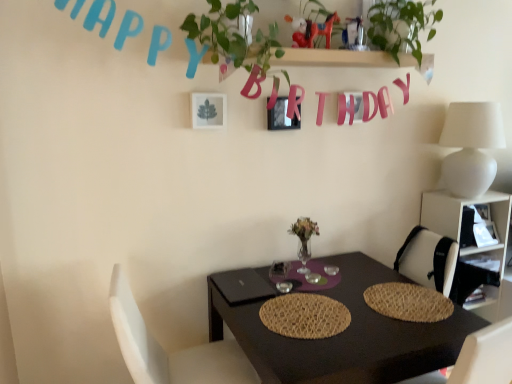
What do you see at coordinates (172, 353) in the screenshot? The image size is (512, 384). I see `white fabric chair at lower left` at bounding box center [172, 353].

This screenshot has width=512, height=384. I want to click on white fabric chair at lower left, so click(x=172, y=353).

Where is `woven straw placemat at center, which appears as the 1th mat when viewed from the left`? This screenshot has height=384, width=512. woven straw placemat at center, which appears as the 1th mat when viewed from the left is located at coordinates tap(305, 316).

I want to click on metallic silver picture frame at upper center, which is the 1th picture frame in left-to-right order, so click(x=208, y=110).

Describe the element at coordinates (354, 107) in the screenshot. I see `pink paper letter at upper center` at that location.

What do you see at coordinates (471, 147) in the screenshot? I see `white matte table lamp at upper right` at bounding box center [471, 147].

What do you see at coordinates (234, 36) in the screenshot? The image size is (512, 384). I see `green leafy plant at upper center` at bounding box center [234, 36].

Where is `woven straw placemat at center, the second mat positioned from the left`? woven straw placemat at center, the second mat positioned from the left is located at coordinates (408, 302).

Between metallic silver picture frame at upper center, which appears as the second picture frame when viewed from the right, and woven straw placemat at center, which appears as the 1th mat when viewed from the left, which one has smaller width?

metallic silver picture frame at upper center, which appears as the second picture frame when viewed from the right.

Is metallic silver picture frame at upper center, which is the 2th picture frame in back-to-front order, not near woven straw placemat at center, which appears as the 1th mat when viewed from the left?

No, metallic silver picture frame at upper center, which is the 2th picture frame in back-to-front order, is not far away from woven straw placemat at center, which appears as the 1th mat when viewed from the left.

Can you tell me how much metallic silver picture frame at upper center, which appears as the second picture frame when viewed from the right, and woven straw placemat at center, arranged as the 2th mat when viewed from the right, differ in facing direction?

The angle between the facing direction of metallic silver picture frame at upper center, which appears as the second picture frame when viewed from the right, and the facing direction of woven straw placemat at center, arranged as the 2th mat when viewed from the right, is 2.2 degrees.

From the image's perspective, is metallic silver picture frame at upper center, which is the 2th picture frame in back-to-front order, over woven straw placemat at center, which appears as the 1th mat when viewed from the left?

Indeed, from the image's perspective, metallic silver picture frame at upper center, which is the 2th picture frame in back-to-front order, is shown above woven straw placemat at center, which appears as the 1th mat when viewed from the left.

In the scene shown: Is white fabric chair at lower left bigger than pink paper letter at upper center?

Yes, white fabric chair at lower left is bigger than pink paper letter at upper center.

Which is behind, white fabric chair at lower left or pink paper letter at upper center?

pink paper letter at upper center is behind.

Would you say white fabric chair at lower left is outside pink paper letter at upper center?

Yes, white fabric chair at lower left is not within pink paper letter at upper center.

Is white fabric chair at lower left facing towards pink paper letter at upper center?

No, white fabric chair at lower left is not turned towards pink paper letter at upper center.

From a real-world perspective, does metallic silver picture frame at upper center, which is the 1th picture frame in right-to-left order, sit lower than green leafy plant at upper right?

Yes, from a real-world perspective, metallic silver picture frame at upper center, which is the 1th picture frame in right-to-left order, is under green leafy plant at upper right.

From the image's perspective, is metallic silver picture frame at upper center, which is the 1th picture frame in right-to-left order, located above or below green leafy plant at upper right?

metallic silver picture frame at upper center, which is the 1th picture frame in right-to-left order, is situated lower than green leafy plant at upper right in the image.

Do you think metallic silver picture frame at upper center, which is the 1th picture frame in right-to-left order, is within green leafy plant at upper right, or outside of it?

metallic silver picture frame at upper center, which is the 1th picture frame in right-to-left order, is spatially situated outside green leafy plant at upper right.

Considering the sizes of objects woven straw placemat at center, the 1th mat from the right, and green leafy plant at upper right in the image provided, who is smaller, woven straw placemat at center, the 1th mat from the right, or green leafy plant at upper right?

Smaller between the two is woven straw placemat at center, the 1th mat from the right.

Is woven straw placemat at center, the 1th mat from the right, aimed at green leafy plant at upper right?

No, woven straw placemat at center, the 1th mat from the right, is not oriented towards green leafy plant at upper right.

From the image's perspective, which is below, woven straw placemat at center, the 1th mat from the right, or green leafy plant at upper right?

From the image's view, woven straw placemat at center, the 1th mat from the right, is below.

Which of these two, woven straw placemat at center, the second mat positioned from the left, or green leafy plant at upper right, stands taller?

green leafy plant at upper right.

Is metallic silver picture frame at upper center, which is the 1th picture frame in right-to-left order, placed right next to black matte table at center?

No, metallic silver picture frame at upper center, which is the 1th picture frame in right-to-left order, is not next to black matte table at center.

From the image's perspective, is metallic silver picture frame at upper center, which is the 1th picture frame in back-to-front order, over black matte table at center?

Yes.

At what (x,y) coordinates should I click in order to perform the action: click on table below the metallic silver picture frame at upper center, arranged as the second picture frame when viewed from the left (from the image's perspective). Please return your answer as a coordinate pair (x, y). This screenshot has width=512, height=384. Looking at the image, I should click on (336, 335).

Between metallic silver picture frame at upper center, which is the 1th picture frame in back-to-front order, and black matte table at center, which one is positioned in front?

black matte table at center is in front.

Is there a large distance between woven straw placemat at center, the 1th mat from the right, and white matte table lamp at upper right?

That's not correct — woven straw placemat at center, the 1th mat from the right, is a little close to white matte table lamp at upper right.

Would you say white matte table lamp at upper right is part of woven straw placemat at center, the second mat positioned from the left,'s contents?

No, white matte table lamp at upper right is located outside of woven straw placemat at center, the second mat positioned from the left.

Does woven straw placemat at center, the second mat positioned from the left, have a greater height compared to white matte table lamp at upper right?

In fact, woven straw placemat at center, the second mat positioned from the left, may be shorter than white matte table lamp at upper right.

Is woven straw placemat at center, the second mat positioned from the left, at the left side of white matte table lamp at upper right?

Indeed, woven straw placemat at center, the second mat positioned from the left, is positioned on the left side of white matte table lamp at upper right.

Is metallic silver picture frame at upper center, which is counted as the first picture frame, starting from the front, not close to white fabric chair at lower left?

No.

Considering their positions, is metallic silver picture frame at upper center, which is counted as the first picture frame, starting from the front, located in front of or behind white fabric chair at lower left?

Visually, metallic silver picture frame at upper center, which is counted as the first picture frame, starting from the front, is located behind white fabric chair at lower left.

From the image's perspective, is metallic silver picture frame at upper center, which is the 1th picture frame in left-to-right order, on top of white fabric chair at lower left?

Yes, from the image's perspective, metallic silver picture frame at upper center, which is the 1th picture frame in left-to-right order, is on top of white fabric chair at lower left.

Which point is more forward, (218, 113) or (214, 382)?

Positioned in front is point (214, 382).

From the image's perspective, starting from the metallic silver picture frame at upper center, which is the 1th picture frame in left-to-right order, which mat is the 2nd one below? Please provide its 2D coordinates.

[(305, 316)]

Find the location of a particular element. The image size is (512, 384). chair on the left of pink paper letter at upper center is located at coordinates (172, 353).

Consider the image. Looking at the image, which one is located further to pink paper letter at upper center, woven straw placemat at center, the second mat positioned from the left, or metallic silver picture frame at upper center, which is counted as the first picture frame, starting from the front?

woven straw placemat at center, the second mat positioned from the left, is positioned further to the anchor pink paper letter at upper center.

Which object lies further to the anchor point white fabric chair at lower left, green leafy plant at upper center or black matte table at center?

green leafy plant at upper center.

Considering their positions, is white fabric chair at lower left positioned further to pink paper letter at upper center than metallic silver picture frame at upper center, which is counted as the second picture frame, starting from the front?

white fabric chair at lower left lies further to pink paper letter at upper center than the other object.

When comparing their distances from woven straw placemat at center, the 1th mat from the right, does black matte table at center or pink paper letter at upper center seem closer?

The object closer to woven straw placemat at center, the 1th mat from the right, is black matte table at center.

When comparing their distances from woven straw placemat at center, arranged as the 2th mat when viewed from the right, does white plastic shelf at right or white matte table lamp at upper right seem closer?

white plastic shelf at right lies closer to woven straw placemat at center, arranged as the 2th mat when viewed from the right, than the other object.

Which object lies nearer to the anchor point woven straw placemat at center, which appears as the 1th mat when viewed from the left, white plastic shelf at right or metallic silver picture frame at upper center, which is the 1th picture frame in back-to-front order?

metallic silver picture frame at upper center, which is the 1th picture frame in back-to-front order, is closer to woven straw placemat at center, which appears as the 1th mat when viewed from the left.

From the picture: From the image, which object appears to be nearer to green leafy plant at upper center, white matte table lamp at upper right or metallic silver picture frame at upper center, which is the 1th picture frame in left-to-right order?

Based on the image, metallic silver picture frame at upper center, which is the 1th picture frame in left-to-right order, appears to be nearer to green leafy plant at upper center.

When comparing their distances from woven straw placemat at center, the 1th mat from the right, does pink paper letter at upper center or metallic silver picture frame at upper center, arranged as the second picture frame when viewed from the left, seem closer?

pink paper letter at upper center is positioned closer to the anchor woven straw placemat at center, the 1th mat from the right.

The width and height of the screenshot is (512, 384). Identify the location of table lamp between pink paper letter at upper center and woven straw placemat at center, the 1th mat from the right, vertically. (471, 147).

This screenshot has width=512, height=384. Identify the location of alphabet between green leafy plant at upper center and white matte table lamp at upper right from left to right. (354, 107).

Locate an element on the screen. table lamp between metallic silver picture frame at upper center, which is the 1th picture frame in back-to-front order, and black matte table at center vertically is located at coordinates (471, 147).

Where is `picture frame between metallic silver picture frame at upper center, which is counted as the second picture frame, starting from the front, and white fabric chair at lower left vertically`? picture frame between metallic silver picture frame at upper center, which is counted as the second picture frame, starting from the front, and white fabric chair at lower left vertically is located at coordinates (208, 110).